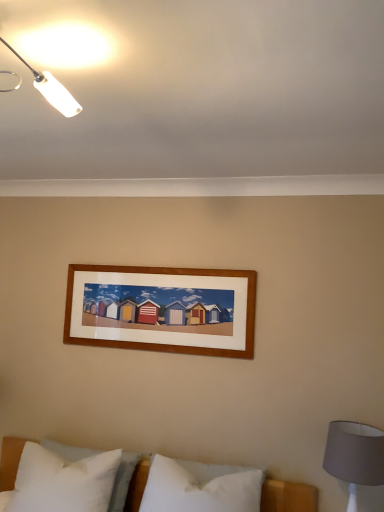
Question: Is point 163,480 closer or farther from the camera than point 340,458?

Choices:
 (A) farther
 (B) closer

Answer: (A)

Question: Looking at their shapes, would you say white soft pillow at center, arranged as the second pillow when viewed from the left, is wider or thinner than gray fabric lampshade at lower right?

Choices:
 (A) thin
 (B) wide

Answer: (A)

Question: Which is farther from the white soft pillow at center, which is the 1th pillow from right to left?

Choices:
 (A) white plastic lamp at upper left
 (B) gray fabric lampshade at lower right
 (C) white soft pillow at lower left, arranged as the 1th pillow when viewed from the left

Answer: (A)

Question: Which object is positioned farthest from the white soft pillow at center, which is the 1th pillow from right to left?

Choices:
 (A) gray fabric lampshade at lower right
 (B) white soft pillow at lower left, which is the 2th pillow from right to left
 (C) white plastic lamp at upper left

Answer: (C)